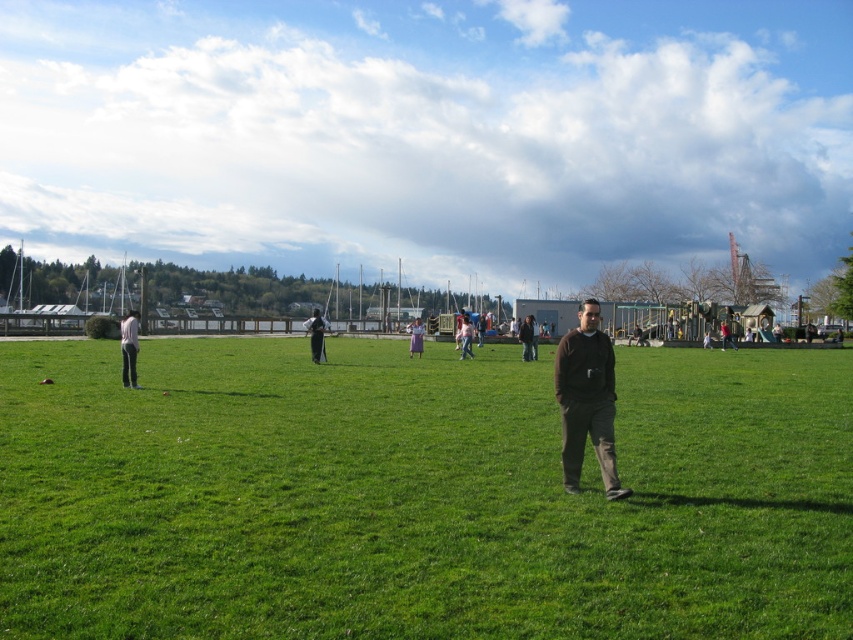
You are a photographer standing at the edge of the grassy field. You want to take a photo that includes both the cloudy sky at upper center and the dark brown sweater at center. Given that your camera can focus on objects within a 150 meter range, will both objects be in focus?

The cloudy sky at upper center is 169.40 meters away from the dark brown sweater at center. Since the camera can only focus within 150 meters, the cloudy sky at upper center is beyond the camera range and cannot be in focus with the dark brown sweater at center.

You are standing at the center of the grassy field in the park scene. You see a man in dark clothing standing at center right and a point marked at coordinates (129, 348) which marks light pink fabric pants at left. Which direction should you move to reach the light pink fabric pants at left from your current position?

To reach the light pink fabric pants at left from your current position at the center of the grassy field, you should move to the left since the point marked at (129, 348) indicates that the light pink fabric pants at left are located to the left side of the scene.

You are a photographer at the park and want to capture both the light pink fabric pants at left and the black fabric pants at center in a single shot. Which person should you focus on first to ensure both are in frame?

You should focus on the light pink fabric pants at left first because it is larger in size than the black fabric pants at center, so it will take up more space in the frame.